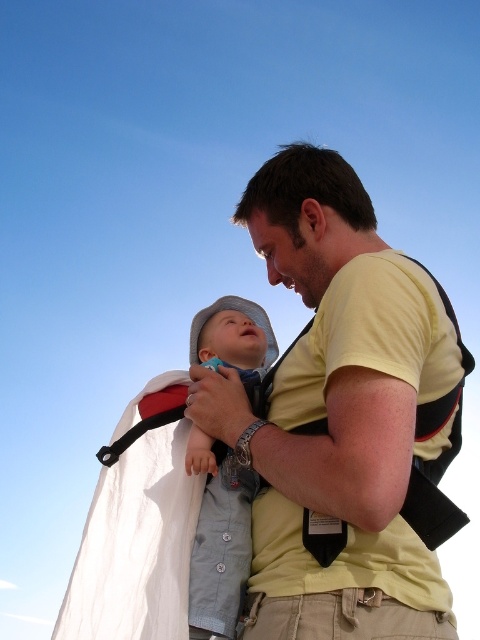
Who is positioned more to the right, yellow cotton shirt at center or light blue denim shirt at center?

From the viewer's perspective, yellow cotton shirt at center appears more on the right side.

Does point (261, 554) lie behind point (225, 605)?

Yes.

This screenshot has width=480, height=640. Find the location of `yellow cotton shirt at center`. yellow cotton shirt at center is located at coordinates (337, 412).

Consider the image. Is yellow cotton shirt at center taller than khaki cotton pants at lower center?

No.

Does yellow cotton shirt at center lie in front of khaki cotton pants at lower center?

No, yellow cotton shirt at center is behind khaki cotton pants at lower center.

Describe the element at coordinates (337, 412) in the screenshot. This screenshot has height=640, width=480. I see `yellow cotton shirt at center` at that location.

Image resolution: width=480 pixels, height=640 pixels. What are the coordinates of `yellow cotton shirt at center` in the screenshot? It's located at coord(337,412).

Is light blue denim shirt at center positioned before khaki cotton pants at lower center?

No, light blue denim shirt at center is further to the viewer.

Is the position of light blue denim shirt at center more distant than that of khaki cotton pants at lower center?

Yes.

This screenshot has width=480, height=640. What do you see at coordinates (217, 544) in the screenshot?
I see `light blue denim shirt at center` at bounding box center [217, 544].

Where is `light blue denim shirt at center`? The image size is (480, 640). light blue denim shirt at center is located at coordinates (217, 544).